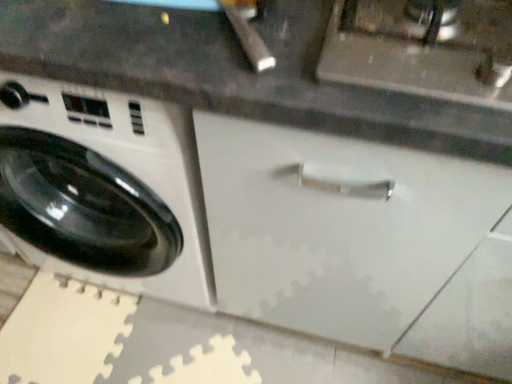
Identify the location of white glossy washing machine at left. The width and height of the screenshot is (512, 384). (105, 190).

What do you see at coordinates (105, 190) in the screenshot? The height and width of the screenshot is (384, 512). I see `white glossy washing machine at left` at bounding box center [105, 190].

Measure the distance between white glossy washing machine at left and camera.

white glossy washing machine at left and camera are 23.25 inches apart from each other.

This screenshot has height=384, width=512. I want to click on white glossy washing machine at left, so click(x=105, y=190).